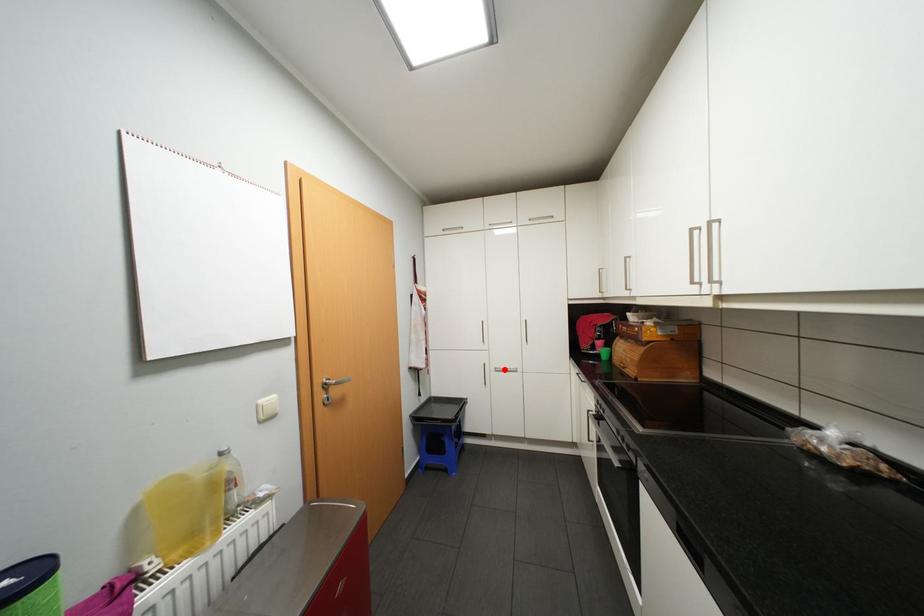
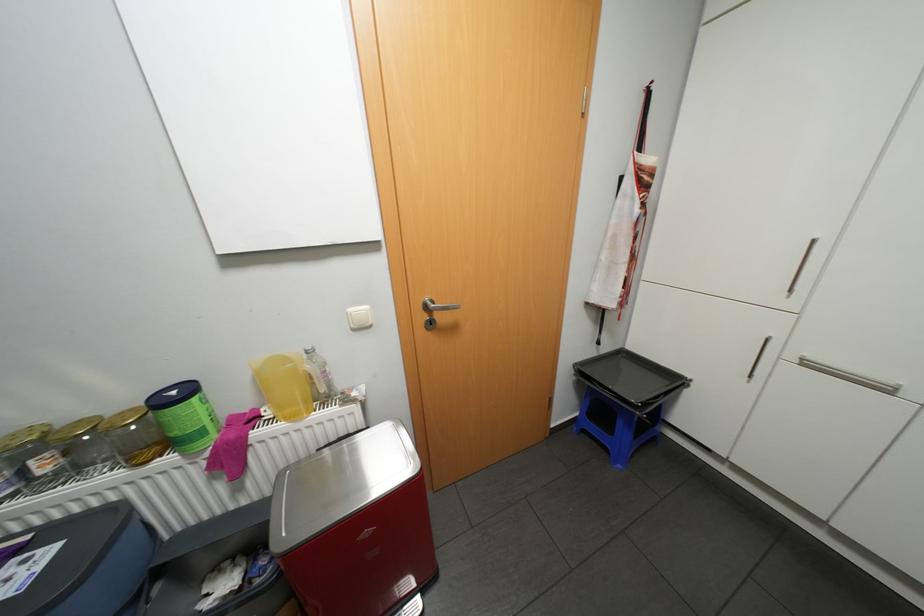
Question: I am providing you with two images of the same scene from different viewpoints. Image1 has a red point marked. In image2, the corresponding 3D location appears at what relative position? Reply with the corresponding letter.

Choices:
 (A) Closer
 (B) Farther

Answer: (A)